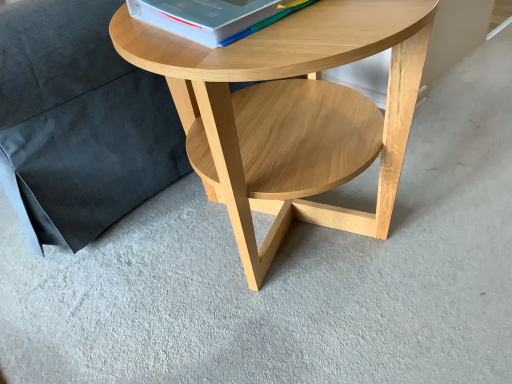
Question: Is point (188, 16) positioned closer to the camera than point (212, 172)?

Choices:
 (A) closer
 (B) farther

Answer: (A)

Question: Choose the correct answer: Is white paper at upper center inside natural wood coffee table at center or outside it?

Choices:
 (A) inside
 (B) outside

Answer: (B)

Question: Which of these objects is positioned farthest from the black fabric pillow at upper left?

Choices:
 (A) natural wood coffee table at center
 (B) white paper at upper center

Answer: (B)

Question: Which is farther from the white paper at upper center?

Choices:
 (A) natural wood coffee table at center
 (B) black fabric pillow at upper left

Answer: (B)